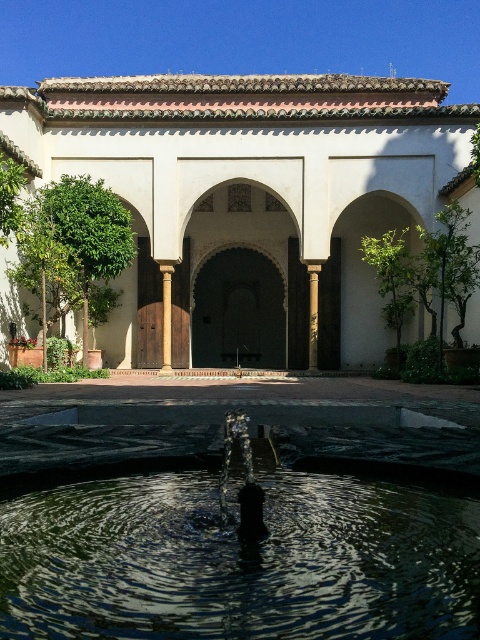
Question: Observing the image, what is the correct spatial positioning of brown stone column at center in reference to smooth stone pillar at center?

Choices:
 (A) right
 (B) left

Answer: (B)

Question: Considering the real-world distances, which object is farthest from the smooth stone pillar at center?

Choices:
 (A) dark stone archway at center
 (B) white stucco palace at center
 (C) brown stone column at center
 (D) clear glass fountain at center

Answer: (D)

Question: From the image, what is the correct spatial relationship of white stucco palace at center in relation to white stone archway at center?

Choices:
 (A) above
 (B) below

Answer: (A)

Question: Can you confirm if clear glass fountain at center is positioned above smooth stone pillar at center?

Choices:
 (A) no
 (B) yes

Answer: (A)

Question: Which point is farther from the camera taking this photo?

Choices:
 (A) (205, 506)
 (B) (217, 330)
 (C) (349, 321)

Answer: (B)

Question: Which object appears closest to the camera in this image?

Choices:
 (A) brown stone column at center
 (B) white stone archway at center

Answer: (A)